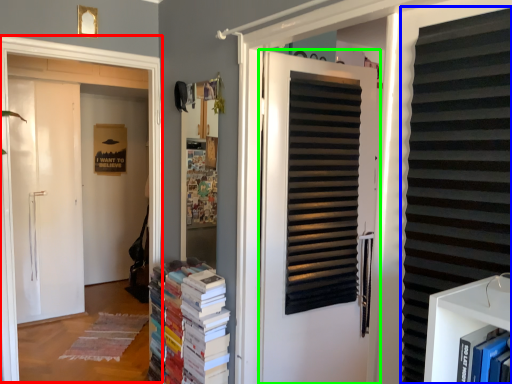
Question: Which object is the farthest from window frame (highlighted by a red box)? Choose among these: shutter (highlighted by a blue box) or door (highlighted by a green box).

Choices:
 (A) shutter
 (B) door

Answer: (A)